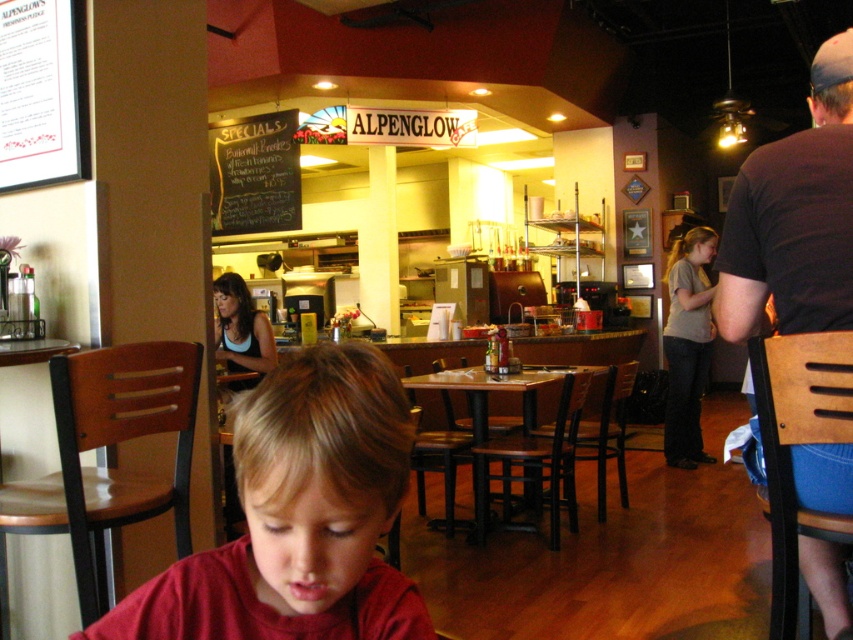
You are a customer in the Alpenglow Cafe and you want to find the matte red shirt at center. According to the coordinates provided, where should you look?

The matte red shirt at center is located at coordinates point (x=299, y=516).

You are a customer in the Alpenglow Cafe and want to sit down. You see the matte red shirt at center and the dark brown leather chair at right. Which object is taller?

The dark brown leather chair at right is taller than the matte red shirt at center.